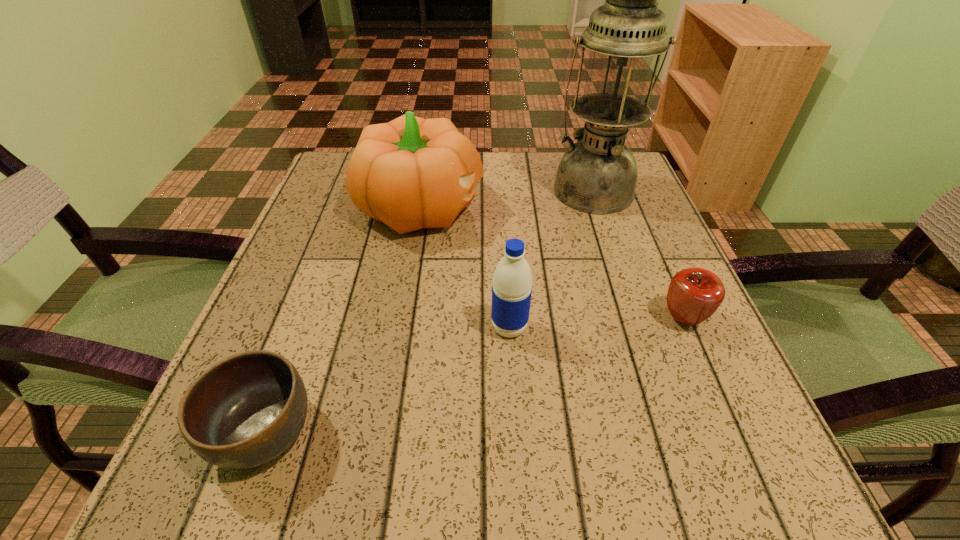
Where is `vacant point located between the apple and the pumpkin`? This screenshot has width=960, height=540. vacant point located between the apple and the pumpkin is located at coordinates (553, 263).

What are the coordinates of `unoccupied position between the third object from left to right and the bowl` in the screenshot? It's located at (387, 380).

The height and width of the screenshot is (540, 960). Identify the location of free area in between the bowl and the third object from right to left. (387, 380).

Select which object is the fourth closest to the water bottle. Please provide its 2D coordinates. Your answer should be formatted as a tuple, i.e. [(x, y)], where the tuple contains the x and y coordinates of a point satisfying the conditions above.

[(598, 174)]

This screenshot has width=960, height=540. What are the coordinates of `object that is the closest to the pumpkin` in the screenshot? It's located at (598, 174).

I want to click on free point that satisfies the following two spatial constraints: 1. on the back side of the apple; 2. on the left side of the nearest object, so click(306, 319).

Identify the location of vacant space that satisfies the following two spatial constraints: 1. on the back side of the apple; 2. on the left side of the nearest object. (306, 319).

Find the location of a particular element. Image resolution: width=960 pixels, height=540 pixels. free region that satisfies the following two spatial constraints: 1. on the carved face of the pumpkin; 2. on the back side of the third object from left to right is located at coordinates (402, 327).

Where is `vacant region that satisfies the following two spatial constraints: 1. on the carved face of the third tallest object; 2. on the right side of the pumpkin`? This screenshot has height=540, width=960. vacant region that satisfies the following two spatial constraints: 1. on the carved face of the third tallest object; 2. on the right side of the pumpkin is located at coordinates point(402,327).

Where is `vacant region that satisfies the following two spatial constraints: 1. on the back side of the third shortest object; 2. on the left side of the tallest object`? vacant region that satisfies the following two spatial constraints: 1. on the back side of the third shortest object; 2. on the left side of the tallest object is located at coordinates (501, 190).